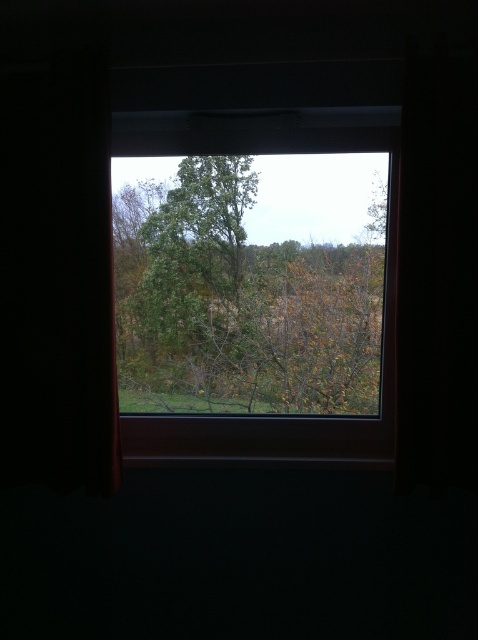
You are trying to hang a large painting on the wall next to the transparent glass window at center and the black fabric curtain at left. Considering their sizes, which object should you place the painting closer to?

The transparent glass window at center has a larger size compared to the black fabric curtain at left, so you should place the painting closer to the transparent glass window at center to ensure proper spacing.